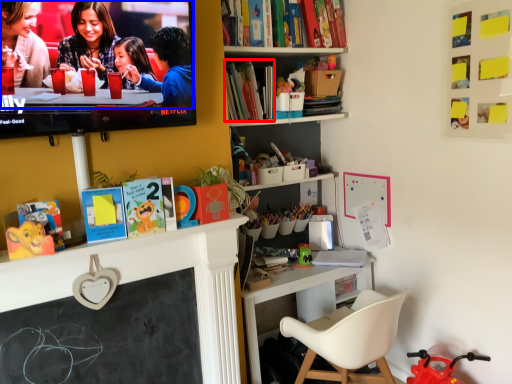
Question: Which object is closer to the camera taking this photo, book (highlighted by a red box) or couple (highlighted by a blue box)?

Choices:
 (A) book
 (B) couple

Answer: (B)